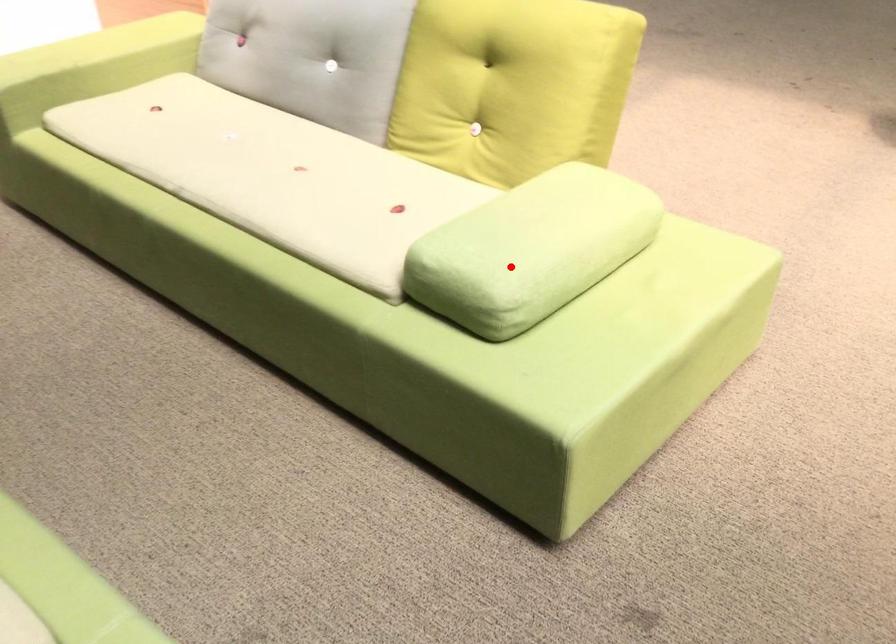
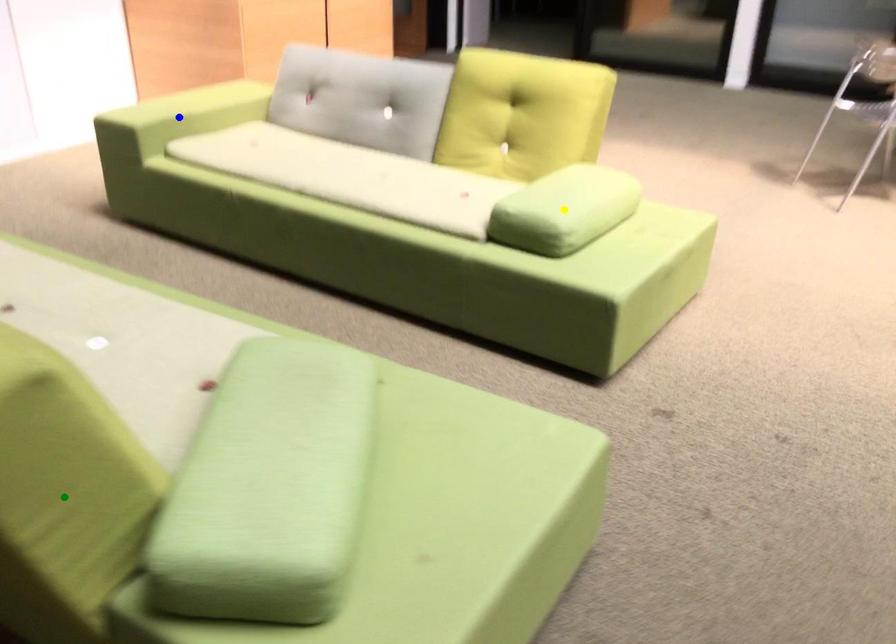
Question: I am providing you with two images of the same scene from different viewpoints. A red point is marked on the first image. You are given multiple points on the second image. Which spot in image 2 lines up with the point in image 1?

Choices:
 (A) yellow point
 (B) blue point
 (C) green point

Answer: (A)